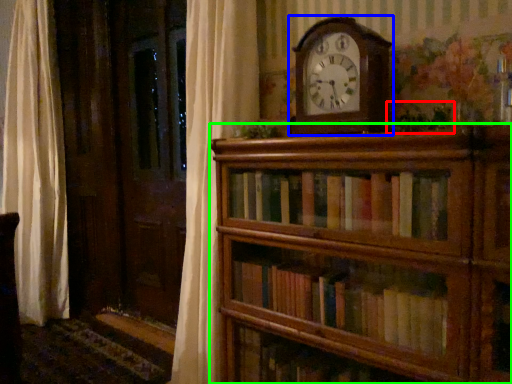
Question: Considering the real-world distances, which object is closest to plant (highlighted by a red box)? wall clock (highlighted by a blue box) or shelf (highlighted by a green box).

Choices:
 (A) wall clock
 (B) shelf

Answer: (A)